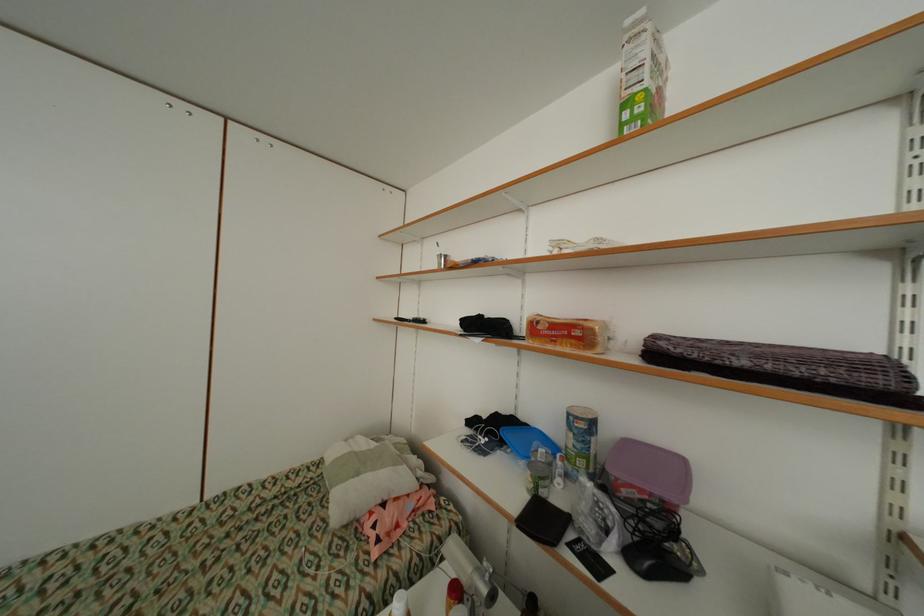
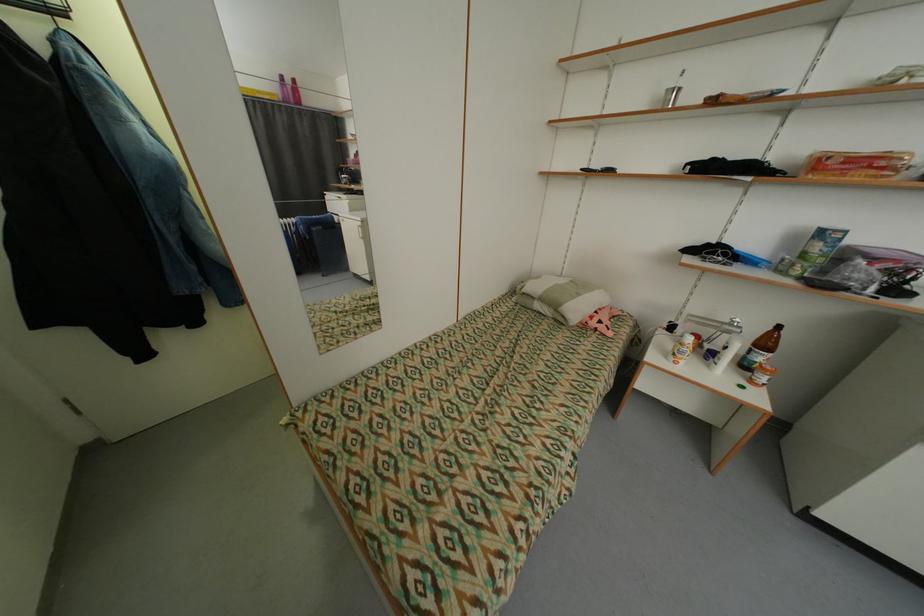
Question: In a continuous first-person perspective shot, in which direction is the camera moving?

Choices:
 (A) Left
 (B) Right
 (C) Forward
 (D) Backward

Answer: (A)